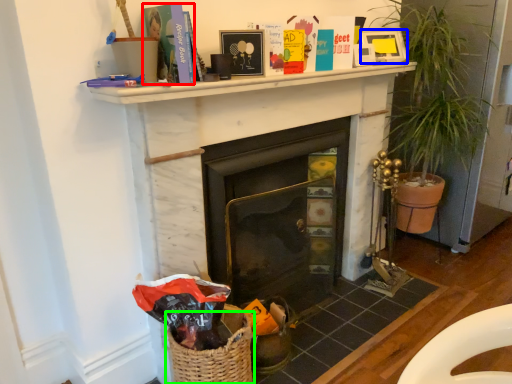
Question: Estimate the real-world distances between objects in this image. Which object is closer to paperback book (highlighted by a red box), picture frame (highlighted by a blue box) or basket (highlighted by a green box)?

Choices:
 (A) picture frame
 (B) basket

Answer: (B)